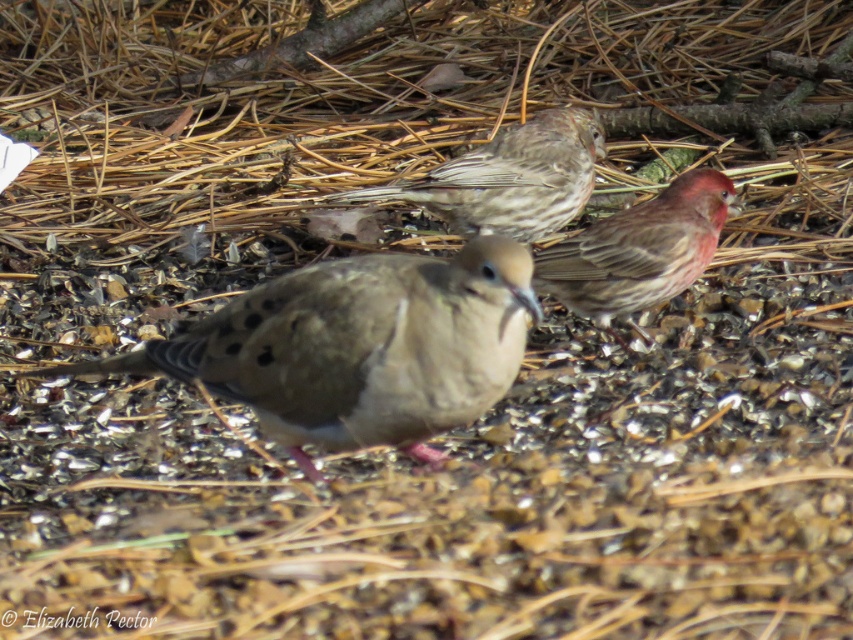
You are a photographer trying to capture a photo of the brown speckled pigeon at center and the brown speckled sparrow at right. From the perspective of the photographer standing in front of the birds, which bird is closer to the left side of the photo?

The brown speckled pigeon at center is positioned on the left side of the brown speckled sparrow at right, so the brown speckled pigeon at center would be closer to the left side of the photo.

In the scene shown: You are a birdwatcher observing the scene. You notice the brown speckled pigeon at center and the brown speckled sparrow at upper center. Which bird is taller?

The brown speckled sparrow at upper center is taller than the brown speckled pigeon at center.